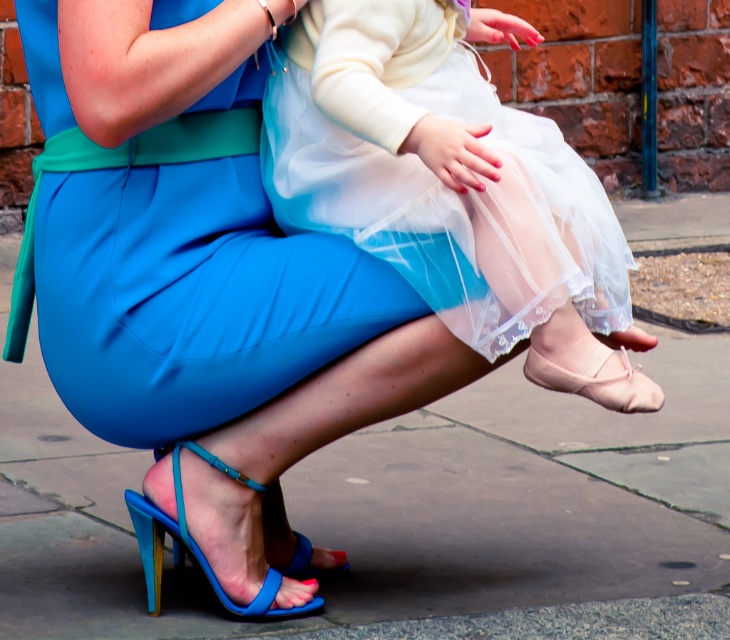
Which of these two, white sheer dress at center or blue glossy sandal at lower left, stands taller?

white sheer dress at center is taller.

Is white sheer dress at center below blue glossy sandal at lower left?

No, white sheer dress at center is not below blue glossy sandal at lower left.

Is point (385, 252) closer to camera compared to point (185, 529)?

Yes, it is.

This screenshot has height=640, width=730. In order to click on white sheer dress at center in this screenshot , I will do `click(434, 173)`.

Is white sheer dress at center smaller than pink satin ballet shoe at lower center?

Actually, white sheer dress at center might be larger than pink satin ballet shoe at lower center.

Which is below, white sheer dress at center or pink satin ballet shoe at lower center?

pink satin ballet shoe at lower center is below.

The width and height of the screenshot is (730, 640). In order to click on white sheer dress at center in this screenshot , I will do `click(434, 173)`.

Does blue glossy sandal at lower left appear on the right side of pink satin ballet shoe at lower center?

Incorrect, blue glossy sandal at lower left is not on the right side of pink satin ballet shoe at lower center.

Who is more forward, (256, 611) or (656, 390)?

Point (656, 390) is in front.

I want to click on blue glossy sandal at lower left, so click(x=196, y=545).